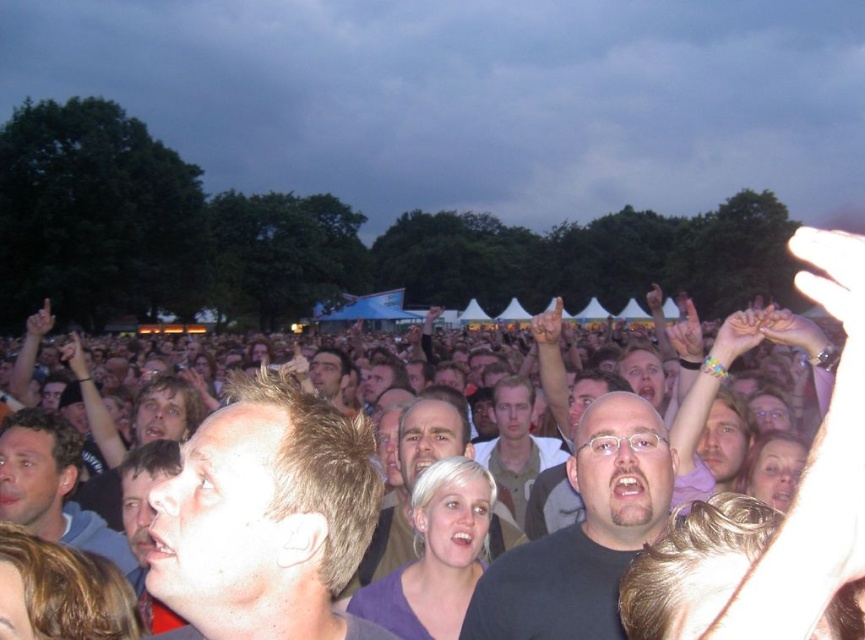
Between point (458, 449) and point (529, 486), which one is positioned behind?

The point (529, 486) is behind.

The height and width of the screenshot is (640, 865). I want to click on smooth brown hair at center, so click(x=413, y=476).

Can you confirm if light brown hair at center is smaller than black matte shirt at center?

Correct, light brown hair at center occupies less space than black matte shirt at center.

Is light brown hair at center taller than black matte shirt at center?

Incorrect, light brown hair at center's height is not larger of black matte shirt at center's.

I want to click on light brown hair at center, so click(x=266, y=518).

Does light brown hair at center have a greater height compared to light brown leather jacket at center?

In fact, light brown hair at center may be shorter than light brown leather jacket at center.

How much distance is there between light brown hair at center and light brown leather jacket at center?

A distance of 15.33 feet exists between light brown hair at center and light brown leather jacket at center.

The height and width of the screenshot is (640, 865). Find the location of `light brown hair at center`. light brown hair at center is located at coordinates coord(266,518).